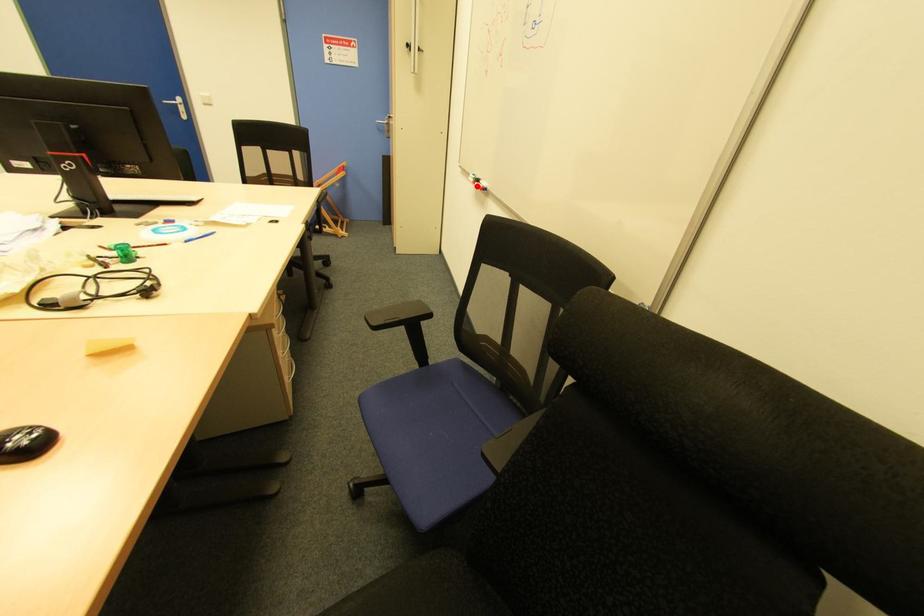
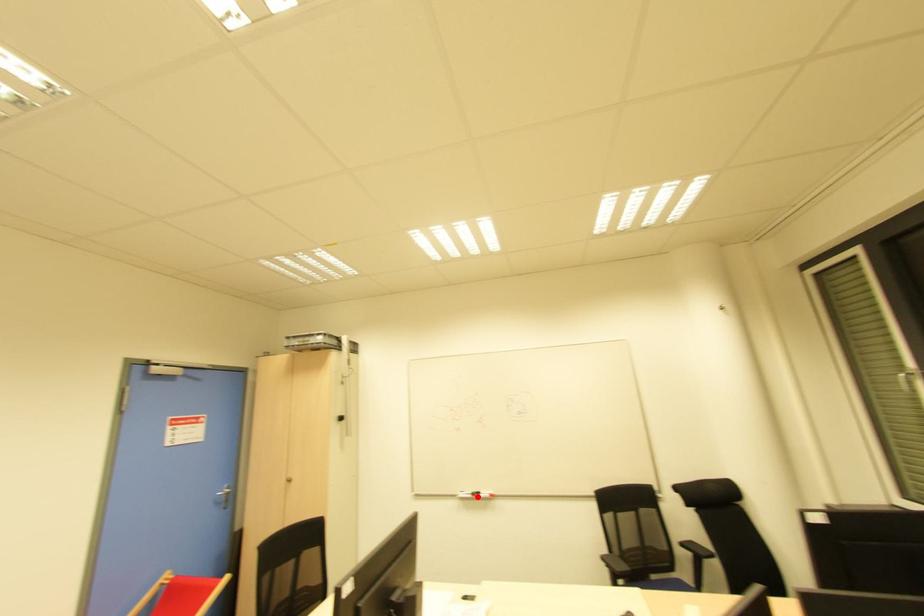
I am providing you with two images of the same scene from different viewpoints. A red point is marked on the first image and another point is marked on the second image. Is the red point in image1 aligned with the point shown in image2?

Yes